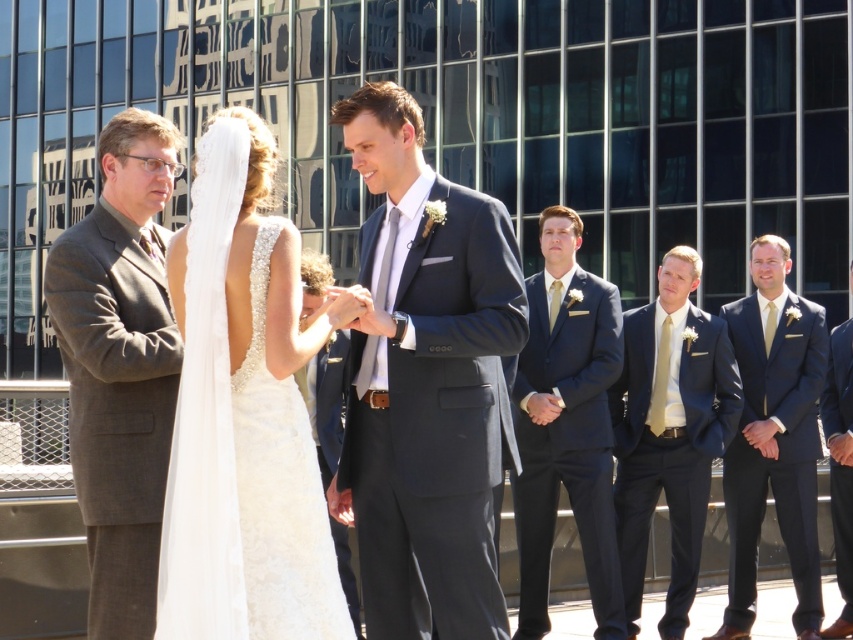
Is gray wool suit at left above navy blue suit at right?

Correct, gray wool suit at left is located above navy blue suit at right.

Is point (109, 294) positioned after point (732, 602)?

No, it is not.

You are a GUI agent. You are given a task and a screenshot of the screen. Output one action in this format:
    pyautogui.click(x=<x>, y=<y>)
    Task: Click on the gray wool suit at left
    
    Given the screenshot: What is the action you would take?
    pyautogui.click(x=120, y=368)

Can you confirm if matte black suit at center is positioned above white lace dress at center?

Actually, matte black suit at center is below white lace dress at center.

Is matte black suit at center closer to camera compared to white lace dress at center?

No, matte black suit at center is further to the viewer.

Find the location of `matte black suit at center`. matte black suit at center is located at coordinates (425, 381).

Does white lace dress at center appear on the right side of navy blue suit at right?

No, white lace dress at center is not to the right of navy blue suit at right.

Can you confirm if white lace dress at center is positioned below navy blue suit at right?

Incorrect, white lace dress at center is not positioned below navy blue suit at right.

Is point (263, 614) positioned before point (793, 436)?

Yes.

Where is `white lace dress at center`? Image resolution: width=853 pixels, height=640 pixels. white lace dress at center is located at coordinates (244, 413).